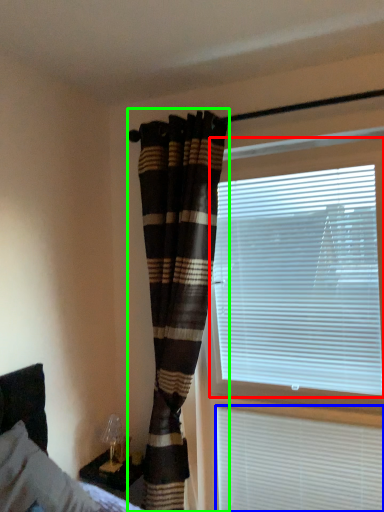
Question: Based on their relative distances, which object is farther from window blind (highlighted by a red box)? Choose from window blind (highlighted by a blue box) and curtain (highlighted by a green box).

Choices:
 (A) window blind
 (B) curtain

Answer: (A)